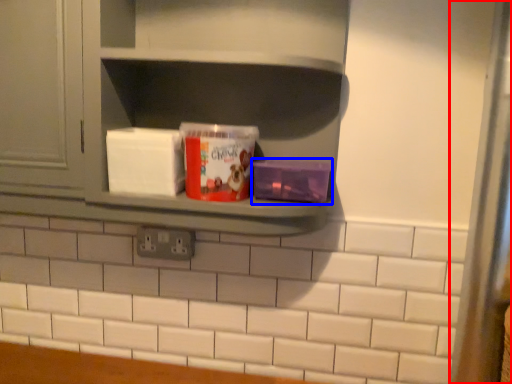
Question: Which object appears closest to the camera in this image, glass door (highlighted by a red box) or carton (highlighted by a blue box)?

Choices:
 (A) glass door
 (B) carton

Answer: (A)